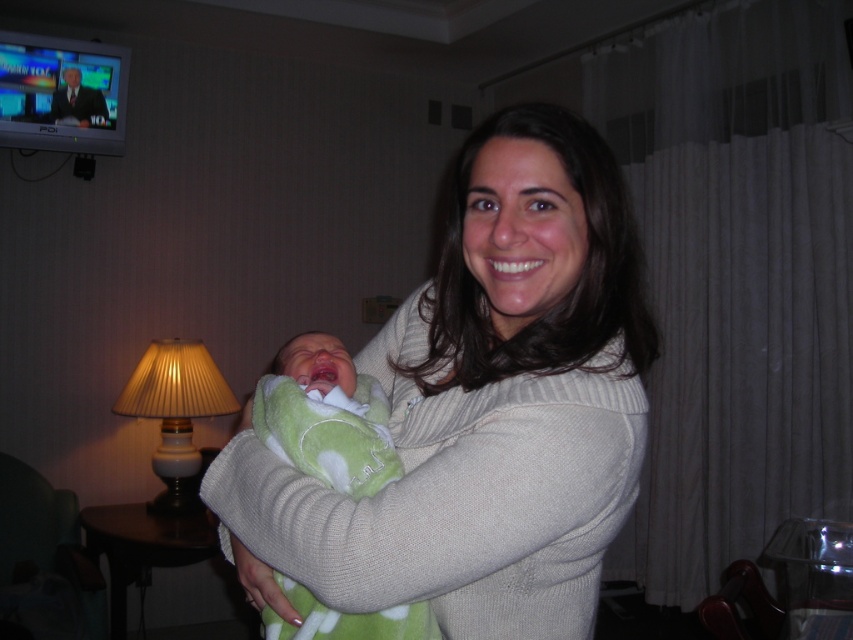
Question: Which object is the farthest from the white knit sweater at center?

Choices:
 (A) matte beige lampshade at left
 (B) green soft blanket at center

Answer: (A)

Question: Does green soft blanket at center have a greater width compared to matte beige lampshade at left?

Choices:
 (A) yes
 (B) no

Answer: (B)

Question: Which point is closer to the camera?

Choices:
 (A) (347, 625)
 (B) (619, 356)
 (C) (125, 385)

Answer: (B)

Question: Can you confirm if white knit sweater at center is bigger than matte beige lampshade at left?

Choices:
 (A) yes
 (B) no

Answer: (A)

Question: Which of these objects is positioned farthest from the matte beige lampshade at left?

Choices:
 (A) white knit sweater at center
 (B) green soft blanket at center

Answer: (A)

Question: Does green soft blanket at center have a lesser width compared to matte beige lampshade at left?

Choices:
 (A) yes
 (B) no

Answer: (A)